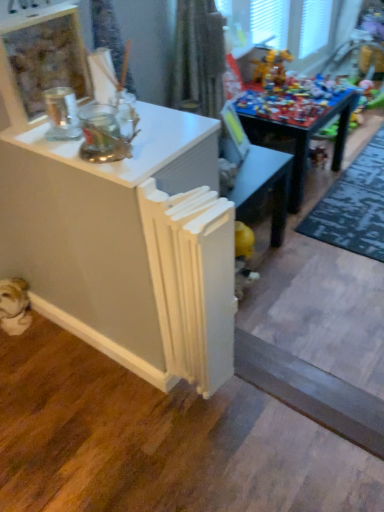
Question: Considering the relative sizes of wooden toy at center and white matte radiator at center in the image provided, is wooden toy at center thinner than white matte radiator at center?

Choices:
 (A) yes
 (B) no

Answer: (B)

Question: Would you say wooden toy at center contains white matte radiator at center?

Choices:
 (A) yes
 (B) no

Answer: (B)

Question: Is wooden toy at center to the left of white matte radiator at center from the viewer's perspective?

Choices:
 (A) yes
 (B) no

Answer: (B)

Question: Can you confirm if wooden toy at center is taller than white matte radiator at center?

Choices:
 (A) no
 (B) yes

Answer: (A)

Question: Is wooden toy at center smaller than white matte radiator at center?

Choices:
 (A) no
 (B) yes

Answer: (A)

Question: Is point (367, 253) positioned closer to the camera than point (38, 102)?

Choices:
 (A) closer
 (B) farther

Answer: (B)

Question: Is green textured rug at lower right wider or thinner than clear glass jar at upper left?

Choices:
 (A) thin
 (B) wide

Answer: (B)

Question: Considering their positions, is green textured rug at lower right located in front of or behind clear glass jar at upper left?

Choices:
 (A) front
 (B) behind

Answer: (B)

Question: From the image's perspective, is green textured rug at lower right located above or below clear glass jar at upper left?

Choices:
 (A) below
 (B) above

Answer: (A)

Question: In terms of size, does clear glass jar at upper left appear bigger or smaller than wooden toy at center?

Choices:
 (A) big
 (B) small

Answer: (B)

Question: From the image's perspective, is clear glass jar at upper left above or below wooden toy at center?

Choices:
 (A) below
 (B) above

Answer: (A)

Question: From a real-world perspective, is clear glass jar at upper left physically located above or below wooden toy at center?

Choices:
 (A) above
 (B) below

Answer: (A)

Question: Considering the positions of clear glass jar at upper left and wooden toy at center in the image, is clear glass jar at upper left taller or shorter than wooden toy at center?

Choices:
 (A) short
 (B) tall

Answer: (A)

Question: Based on their positions, is white matte radiator at center located to the left or right of clear glass jar at upper left?

Choices:
 (A) right
 (B) left

Answer: (A)

Question: Considering the positions of point (182, 280) and point (36, 96), is point (182, 280) closer or farther from the camera than point (36, 96)?

Choices:
 (A) closer
 (B) farther

Answer: (A)